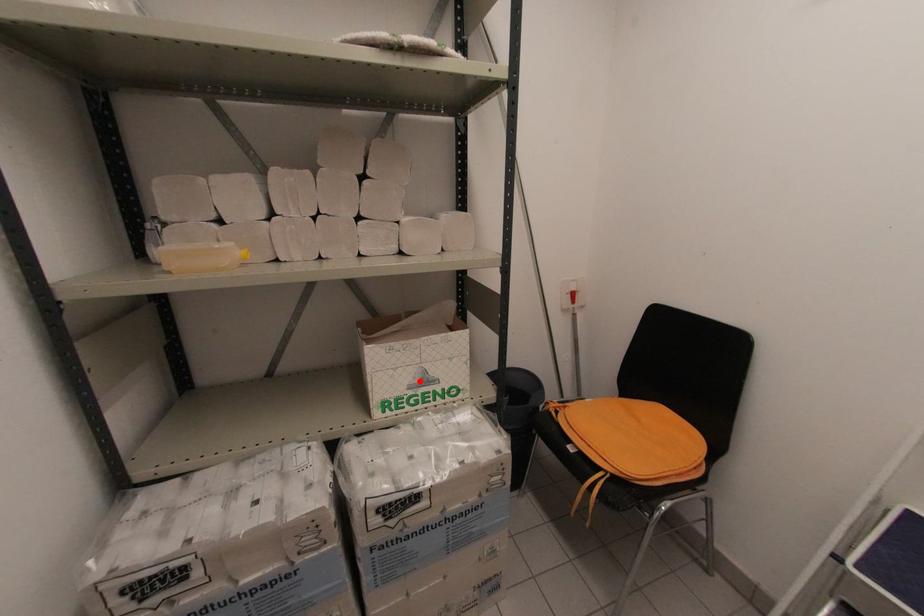
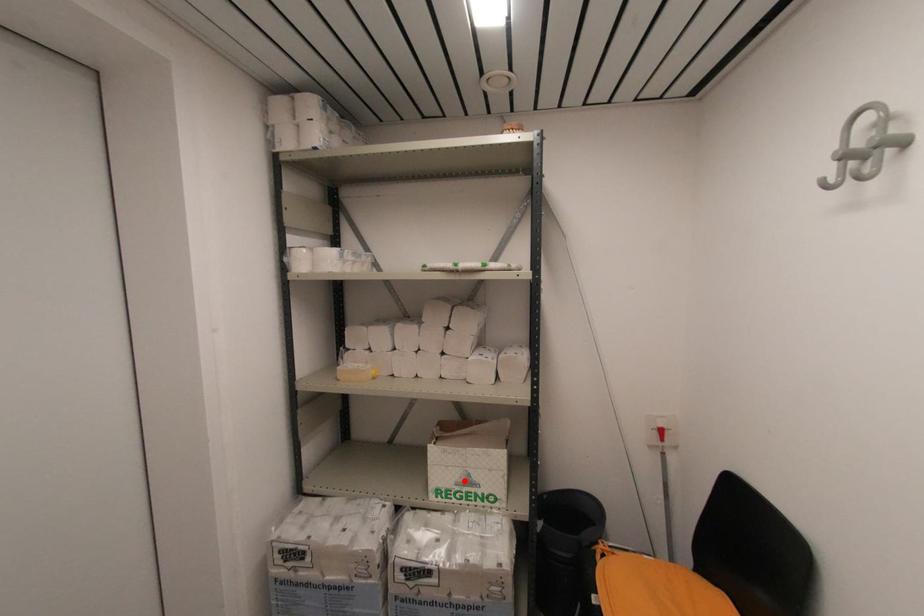
I am providing you with two images of the same scene from different viewpoints. A red point is marked on the first image and another point is marked on the second image. Does the point marked in image1 correspond to the same location as the one in image2?

Yes